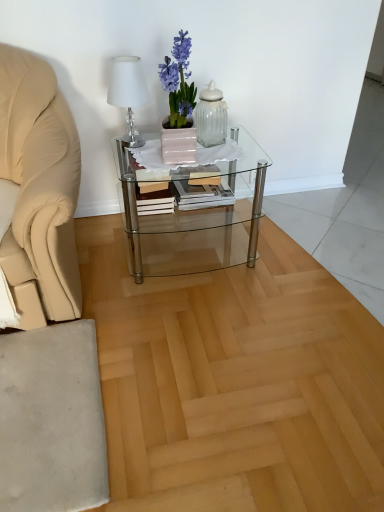
Question: Is white fabric lampshade at upper left wider than clear glass coffee table at center?

Choices:
 (A) yes
 (B) no

Answer: (B)

Question: Considering the relative sizes of white fabric lampshade at upper left and clear glass coffee table at center in the image provided, is white fabric lampshade at upper left bigger than clear glass coffee table at center?

Choices:
 (A) no
 (B) yes

Answer: (A)

Question: Is white fabric lampshade at upper left oriented towards clear glass coffee table at center?

Choices:
 (A) no
 (B) yes

Answer: (A)

Question: Does white fabric lampshade at upper left have a greater height compared to clear glass coffee table at center?

Choices:
 (A) no
 (B) yes

Answer: (A)

Question: Is the surface of white fabric lampshade at upper left in direct contact with clear glass coffee table at center?

Choices:
 (A) yes
 (B) no

Answer: (B)

Question: Can we say white fabric lampshade at upper left lies outside clear glass coffee table at center?

Choices:
 (A) no
 (B) yes

Answer: (B)

Question: Would you say wooden book at center is part of clear glass coffee table at center's contents?

Choices:
 (A) yes
 (B) no

Answer: (A)

Question: Is clear glass coffee table at center far away from wooden book at center?

Choices:
 (A) no
 (B) yes

Answer: (A)

Question: Does clear glass coffee table at center appear on the left side of wooden book at center?

Choices:
 (A) yes
 (B) no

Answer: (A)

Question: Is clear glass coffee table at center oriented away from wooden book at center?

Choices:
 (A) no
 (B) yes

Answer: (B)

Question: Is clear glass coffee table at center smaller than wooden book at center?

Choices:
 (A) no
 (B) yes

Answer: (A)

Question: From the image's perspective, is clear glass coffee table at center beneath wooden book at center?

Choices:
 (A) no
 (B) yes

Answer: (B)

Question: Is clear glass jar at center positioned with its back to clear glass coffee table at center?

Choices:
 (A) no
 (B) yes

Answer: (A)